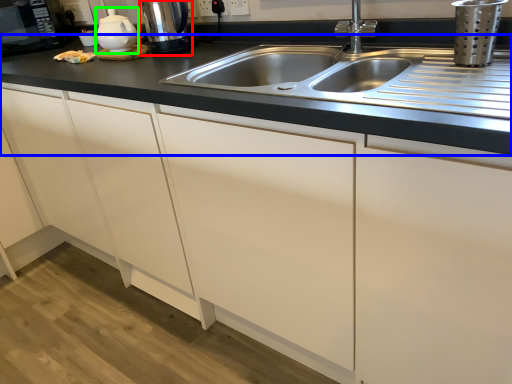
Question: Which is farther away from coffee machine (highlighted by a red box)? countertop (highlighted by a blue box) or tea pot (highlighted by a green box)?

Choices:
 (A) countertop
 (B) tea pot

Answer: (A)